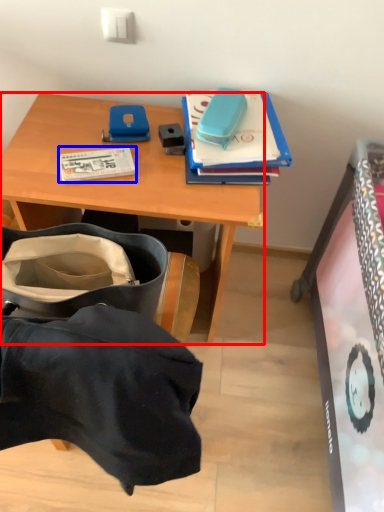
Question: Which of the following is the closest to the observer, desk (highlighted by a red box) or book (highlighted by a blue box)?

Choices:
 (A) desk
 (B) book

Answer: (A)